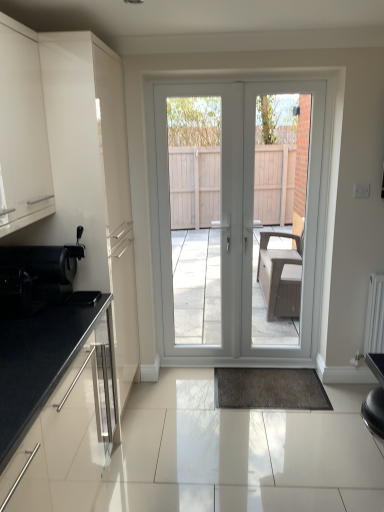
The image size is (384, 512). Find the location of `free space above white plastic door at center, the 1th screen door viewed from the right (from a real-world perspective)`. free space above white plastic door at center, the 1th screen door viewed from the right (from a real-world perspective) is located at coordinates (289, 78).